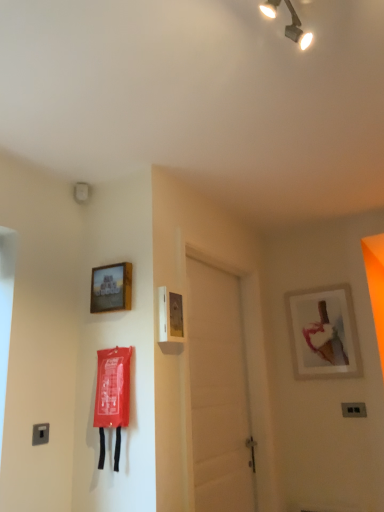
Question: Is wooden frame at upper left, the 1th picture frame when ordered from front to back, oriented away from satin silver switch at lower left, the second light switch in the back-to-front sequence?

Choices:
 (A) yes
 (B) no

Answer: (B)

Question: Is wooden frame at upper left, the 1th picture frame when ordered from front to back, closer to the viewer compared to satin silver switch at lower left, the second light switch in the back-to-front sequence?

Choices:
 (A) yes
 (B) no

Answer: (B)

Question: Can you confirm if wooden frame at upper left, placed as the 2th picture frame when sorted from bottom to top, is smaller than satin silver switch at lower left, the second light switch when ordered from bottom to top?

Choices:
 (A) no
 (B) yes

Answer: (A)

Question: From the image's perspective, does wooden frame at upper left, the 1th picture frame positioned from the top, appear lower than satin silver switch at lower left, the second light switch when ordered from bottom to top?

Choices:
 (A) yes
 (B) no

Answer: (B)

Question: Is wooden frame at upper left, placed as the second picture frame when sorted from right to left, completely or partially outside of satin silver switch at lower left, the second light switch in the back-to-front sequence?

Choices:
 (A) no
 (B) yes

Answer: (B)

Question: Can you confirm if wooden frame at upper left, the 1th picture frame when ordered from front to back, is bigger than satin silver switch at lower left, marked as the first light switch in a top-to-bottom arrangement?

Choices:
 (A) yes
 (B) no

Answer: (A)

Question: Is metallic track lighting at upper center facing away from matte white picture frame at upper right, arranged as the 2th picture frame when viewed from the left?

Choices:
 (A) yes
 (B) no

Answer: (B)

Question: Is matte white picture frame at upper right, arranged as the 2th picture frame when viewed from the left, a part of metallic track lighting at upper center?

Choices:
 (A) no
 (B) yes

Answer: (A)

Question: Does metallic track lighting at upper center have a lesser height compared to matte white picture frame at upper right, which is the first picture frame from bottom to top?

Choices:
 (A) no
 (B) yes

Answer: (B)

Question: Considering the relative sizes of metallic track lighting at upper center and matte white picture frame at upper right, which appears as the 1th picture frame when viewed from the back, in the image provided, is metallic track lighting at upper center taller than matte white picture frame at upper right, which appears as the 1th picture frame when viewed from the back,?

Choices:
 (A) no
 (B) yes

Answer: (A)

Question: Can you confirm if metallic track lighting at upper center is wider than matte white picture frame at upper right, the 2th picture frame when ordered from top to bottom?

Choices:
 (A) no
 (B) yes

Answer: (B)

Question: Considering the relative sizes of metallic track lighting at upper center and matte white picture frame at upper right, arranged as the 2th picture frame when viewed from the left, in the image provided, is metallic track lighting at upper center smaller than matte white picture frame at upper right, arranged as the 2th picture frame when viewed from the left,?

Choices:
 (A) yes
 (B) no

Answer: (A)

Question: Is matte white picture frame at upper right, which is the first picture frame from bottom to top, aimed at black plastic light switch at lower right, which is the first light switch in back-to-front order?

Choices:
 (A) yes
 (B) no

Answer: (B)